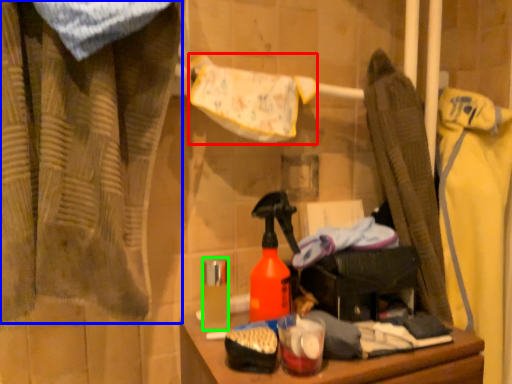
Question: Estimate the real-world distances between objects in this image. Which object is closer to bath towel (highlighted by a red box), curtain (highlighted by a blue box) or toiletry (highlighted by a green box)?

Choices:
 (A) curtain
 (B) toiletry

Answer: (A)